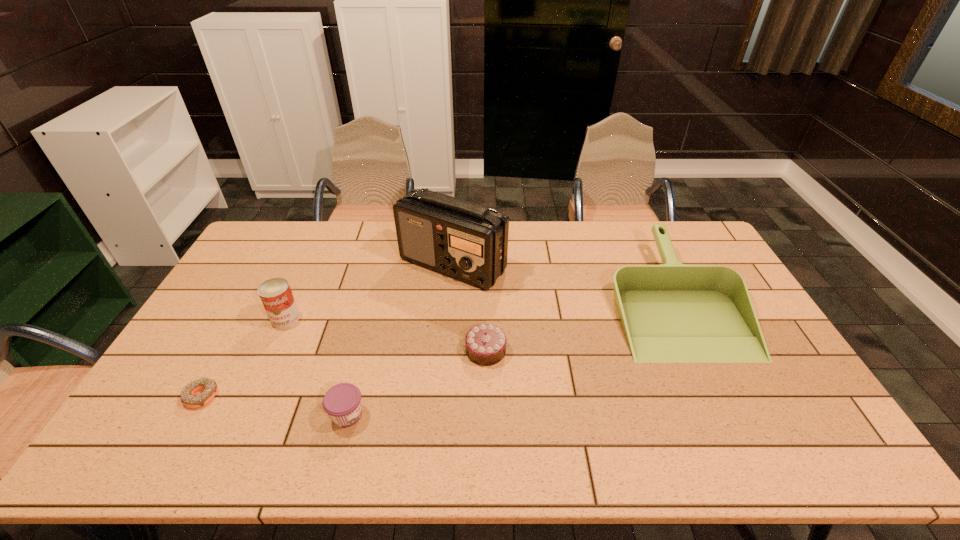
Find the location of a particular element. This screenshot has width=960, height=540. the tallest object is located at coordinates (468, 242).

This screenshot has width=960, height=540. I want to click on the second object from left to right, so click(x=276, y=295).

At what (x,y) coordinates should I click in order to perform the action: click on dustpan. Please return your answer as a coordinate pair (x, y). Looking at the image, I should click on (672, 313).

Where is `the fourth object from right to left`? the fourth object from right to left is located at coordinates (342, 402).

Locate an element on the screen. The width and height of the screenshot is (960, 540). chocolate cake is located at coordinates (485, 344).

At what (x,y) coordinates should I click in order to perform the action: click on doughnut. Please return your answer as a coordinate pair (x, y). The height and width of the screenshot is (540, 960). Looking at the image, I should click on (188, 399).

The height and width of the screenshot is (540, 960). In order to click on the leftmost object in this screenshot , I will do `click(188, 399)`.

Locate an element on the screen. The image size is (960, 540). vacant space located on the front panel of the tallest object is located at coordinates pos(444,385).

Locate an element on the screen. free space located 0.330m on the front label of the fifth object from right to left is located at coordinates (235, 429).

What are the coordinates of `vacant space located 0.210m on the scoop of the dustpan` in the screenshot? It's located at (736, 432).